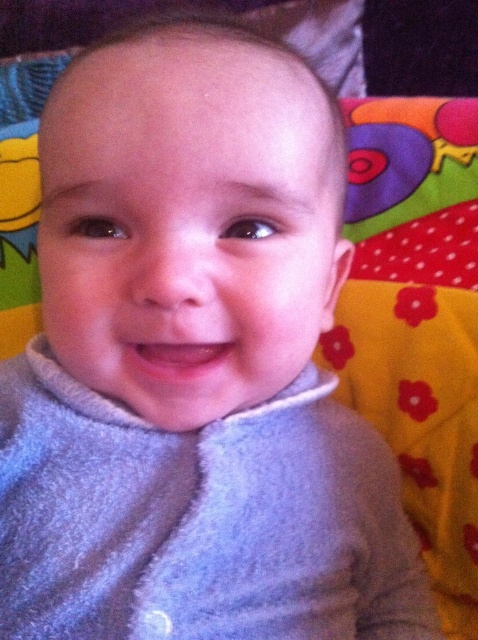
Locate an element on the screen. The image size is (478, 640). gray soft baby at center is located at coordinates (188, 220).

Who is more distant from viewer, (167, 45) or (95, 500)?

Positioned behind is point (95, 500).

Is point (118, 125) positioned after point (23, 387)?

No.

Where is `gray soft baby at center`? The width and height of the screenshot is (478, 640). gray soft baby at center is located at coordinates click(x=188, y=220).